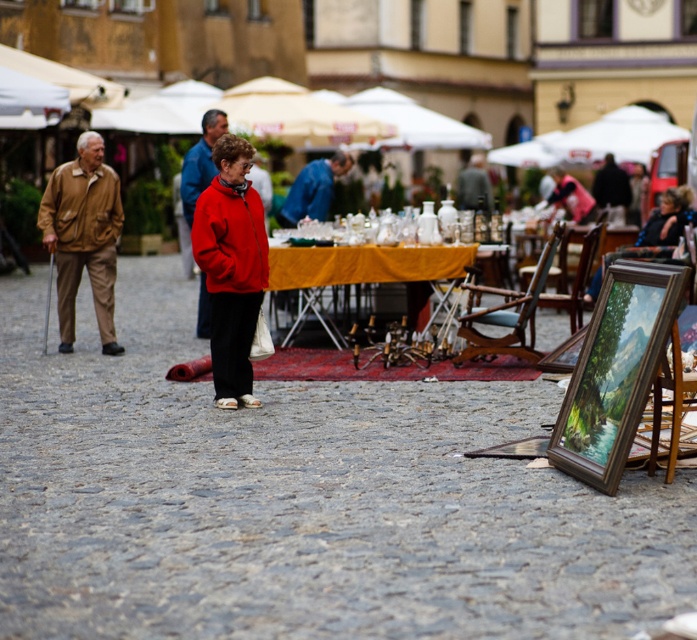
You are a fashion designer observing the two jackets at a market. The matte red jacket at center and the red fleece jacket at center are both displayed. Which jacket is taller in height?

The matte red jacket at center is taller than the red fleece jacket at center.

You are a photographer standing in the market and want to take a photo of both the matte red jacket at center and the red fleece jacket at center. Which jacket should you focus on first to ensure both are in sharp focus?

You should focus on the matte red jacket at center first since it is closer to the viewer. By focusing on the closer object, the depth of field may extend to include the farther red fleece jacket at center in acceptable focus.